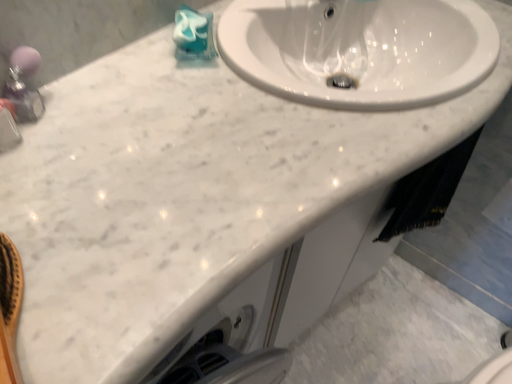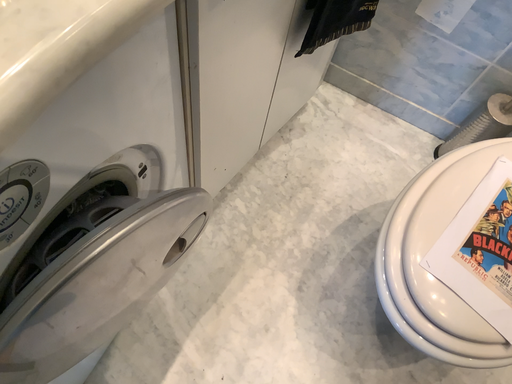
Question: How did the camera likely rotate when shooting the video?

Choices:
 (A) rotated right
 (B) rotated left

Answer: (A)